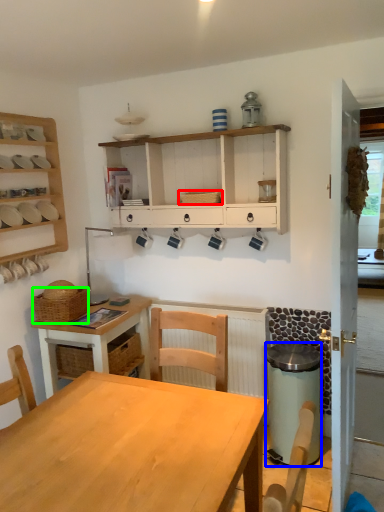
Question: Which object is positioned closest to basket (highlighted by a red box)? Select from trash bin/can (highlighted by a blue box) and basket (highlighted by a green box).

Choices:
 (A) trash bin/can
 (B) basket

Answer: (B)